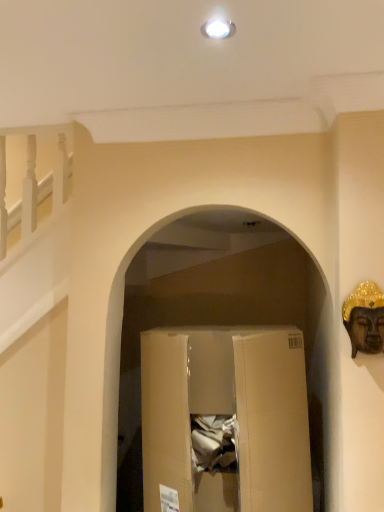
Question: From a real-world perspective, is brown cardboard box at center positioned above or below gold metallic buddha head at right?

Choices:
 (A) below
 (B) above

Answer: (A)

Question: Is point (220, 343) closer or farther from the camera than point (365, 342)?

Choices:
 (A) closer
 (B) farther

Answer: (B)

Question: From their relative heights in the image, would you say brown cardboard box at center is taller or shorter than gold metallic buddha head at right?

Choices:
 (A) tall
 (B) short

Answer: (A)

Question: In terms of height, does gold metallic buddha head at right look taller or shorter compared to brown cardboard box at center?

Choices:
 (A) tall
 (B) short

Answer: (B)

Question: From the image's perspective, is gold metallic buddha head at right above or below brown cardboard box at center?

Choices:
 (A) above
 (B) below

Answer: (A)

Question: Considering the positions of gold metallic buddha head at right and brown cardboard box at center in the image, is gold metallic buddha head at right wider or thinner than brown cardboard box at center?

Choices:
 (A) wide
 (B) thin

Answer: (B)

Question: In the image, is gold metallic buddha head at right positioned in front of or behind brown cardboard box at center?

Choices:
 (A) front
 (B) behind

Answer: (A)